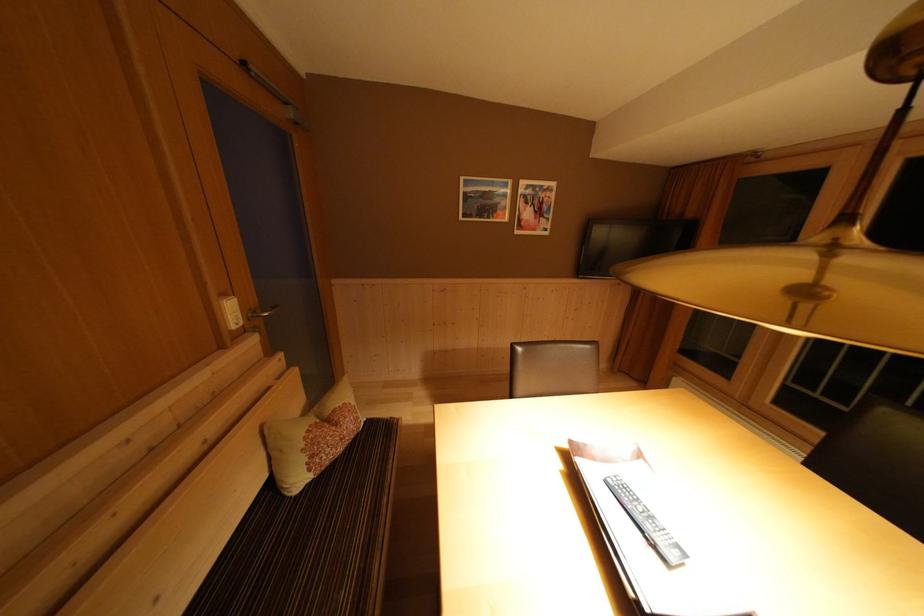
The location [311,439] corresponds to which object?

It corresponds to the patterned pillow in the image.